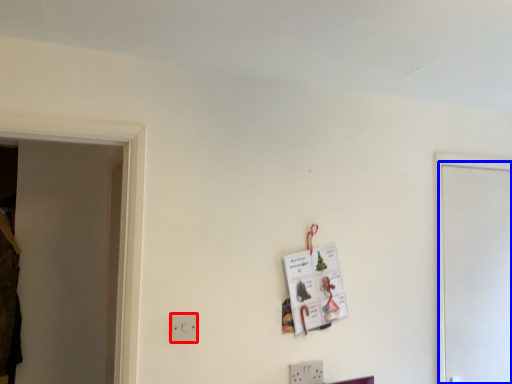
Question: Which point is closer to the camera, light switch (highlighted by a red box) or door (highlighted by a blue box)?

Choices:
 (A) light switch
 (B) door

Answer: (A)